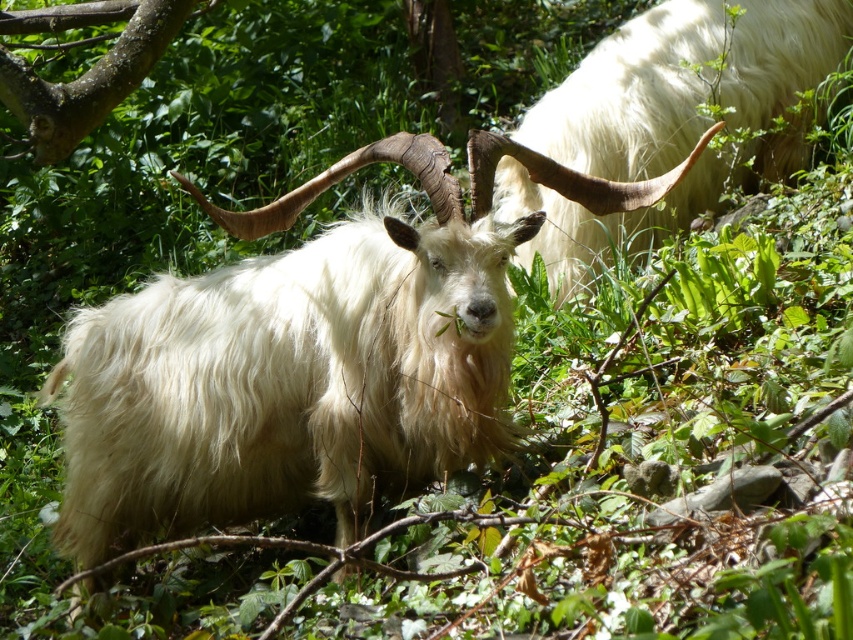
Is white woolen goat at center above white woolly goat at upper right?

No, white woolen goat at center is not above white woolly goat at upper right.

Who is positioned more to the right, white woolen goat at center or white woolly goat at upper right?

white woolly goat at upper right

Is point (483, 228) in front of point (628, 120)?

That is True.

This screenshot has width=853, height=640. I want to click on white woolen goat at center, so click(306, 356).

Who is shorter, white woolen goat at center or brown rough bark at upper left?

brown rough bark at upper left

Between point (256, 307) and point (10, 13), which one is positioned behind?

The point (10, 13) is behind.

The height and width of the screenshot is (640, 853). I want to click on white woolen goat at center, so click(x=306, y=356).

Is white woolly goat at upper right shorter than brown rough bark at upper left?

No.

Is point (775, 140) positioned before point (38, 76)?

No, (775, 140) is behind (38, 76).

You are a GUI agent. You are given a task and a screenshot of the screen. Output one action in this format:
    pyautogui.click(x=<x>, y=<y>)
    Task: Click on the white woolly goat at upper right
    
    Given the screenshot: What is the action you would take?
    pyautogui.click(x=665, y=120)